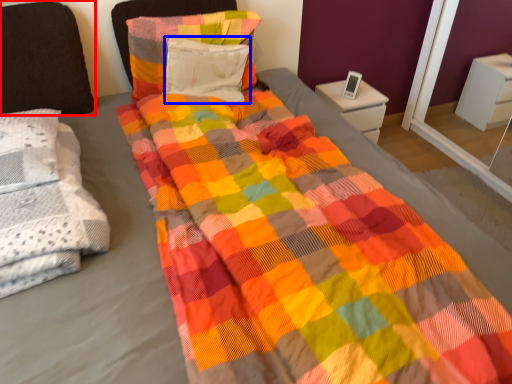
Question: Which object appears farthest to the camera in this image, pillow (highlighted by a red box) or pillow (highlighted by a blue box)?

Choices:
 (A) pillow
 (B) pillow

Answer: (B)